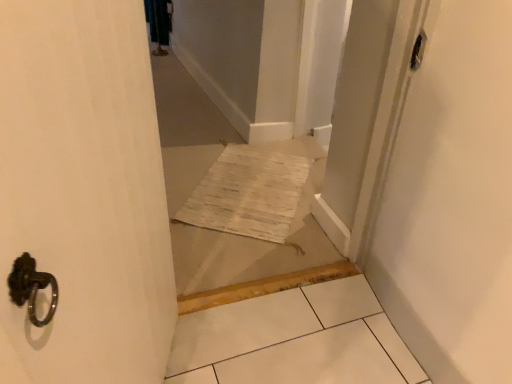
Question: Does transparent plastic screen door at upper right appear on the right side of white woven mat at center?

Choices:
 (A) no
 (B) yes

Answer: (B)

Question: From the image's perspective, is transparent plastic screen door at upper right beneath white woven mat at center?

Choices:
 (A) yes
 (B) no

Answer: (A)

Question: From a real-world perspective, is transparent plastic screen door at upper right positioned over white woven mat at center based on gravity?

Choices:
 (A) no
 (B) yes

Answer: (B)

Question: Does transparent plastic screen door at upper right appear on the left side of white woven mat at center?

Choices:
 (A) no
 (B) yes

Answer: (A)

Question: Is transparent plastic screen door at upper right oriented towards white woven mat at center?

Choices:
 (A) yes
 (B) no

Answer: (B)

Question: Is the position of transparent plastic screen door at upper right less distant than that of white woven mat at center?

Choices:
 (A) no
 (B) yes

Answer: (A)

Question: Does white woven mat at center have a lesser height compared to transparent plastic screen door at upper right?

Choices:
 (A) no
 (B) yes

Answer: (B)

Question: Can you confirm if white woven mat at center is wider than transparent plastic screen door at upper right?

Choices:
 (A) no
 (B) yes

Answer: (B)

Question: Does white woven mat at center have a lesser width compared to transparent plastic screen door at upper right?

Choices:
 (A) no
 (B) yes

Answer: (A)

Question: From the image's perspective, would you say white woven mat at center is positioned over transparent plastic screen door at upper right?

Choices:
 (A) yes
 (B) no

Answer: (A)

Question: Does white woven mat at center come in front of transparent plastic screen door at upper right?

Choices:
 (A) yes
 (B) no

Answer: (A)

Question: Is white woven mat at center completely or partially outside of transparent plastic screen door at upper right?

Choices:
 (A) yes
 (B) no

Answer: (A)

Question: From a real-world perspective, is white woven mat at center above or below transparent plastic screen door at upper right?

Choices:
 (A) above
 (B) below

Answer: (B)